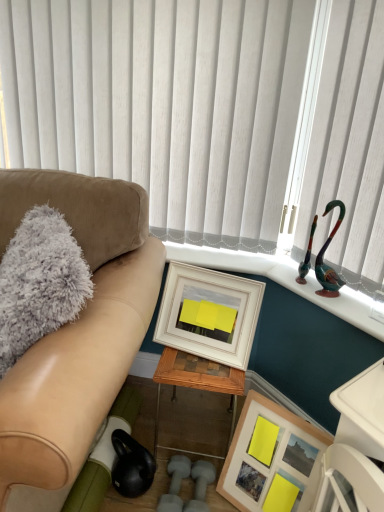
Describe the element at coordinates (164, 104) in the screenshot. The width and height of the screenshot is (384, 512). I see `white vertical blinds at upper center` at that location.

You are a GUI agent. You are given a task and a screenshot of the screen. Output one action in this format:
    pyautogui.click(x=<x>, y=<y>)
    Task: Click on the wooden framed picture at lower right, the 1th picture frame from the bottom
    
    Given the screenshot: What is the action you would take?
    pyautogui.click(x=272, y=458)

Measure the distance between suede couch at left and camera.

suede couch at left and camera are 72.38 centimeters apart.

Measure the distance between matte white picture frame at center, which appears as the second picture frame when ordered from the bottom, and camera.

matte white picture frame at center, which appears as the second picture frame when ordered from the bottom, and camera are 4.30 feet apart.

Locate an element on the screen. matte white picture frame at center, which appears as the second picture frame when ordered from the bottom is located at coordinates (209, 314).

The image size is (384, 512). I want to click on white vertical blinds at upper center, so coord(164,104).

How different are the orientations of suede couch at left and matte white picture frame at center, which appears as the second picture frame when ordered from the bottom, in degrees?

The angular difference between suede couch at left and matte white picture frame at center, which appears as the second picture frame when ordered from the bottom, is 13.2 degrees.

From a real-world perspective, who is located higher, suede couch at left or matte white picture frame at center, which appears as the second picture frame when ordered from the bottom?

matte white picture frame at center, which appears as the second picture frame when ordered from the bottom, from a real-world perspective.

From the image's perspective, which is above, suede couch at left or matte white picture frame at center, which is the first picture frame in top-to-bottom order?

matte white picture frame at center, which is the first picture frame in top-to-bottom order, from the image's perspective.

Considering the sizes of suede couch at left and matte white picture frame at center, which appears as the second picture frame when ordered from the bottom, in the image, is suede couch at left wider or thinner than matte white picture frame at center, which appears as the second picture frame when ordered from the bottom,?

Considering their sizes, suede couch at left looks broader than matte white picture frame at center, which appears as the second picture frame when ordered from the bottom.

Is point (78, 292) closer or farther from the camera than point (244, 412)?

Point (78, 292) appears to be closer to the viewer than point (244, 412).

Between gray fluffy pillow at left and wooden framed picture at lower right, the 1th picture frame from the bottom, which one has larger size?

Bigger between the two is gray fluffy pillow at left.

Where is `pillow above the wooden framed picture at lower right, the 1th picture frame from the bottom (from the image's perspective)`? pillow above the wooden framed picture at lower right, the 1th picture frame from the bottom (from the image's perspective) is located at coordinates (40, 282).

Is wooden framed picture at lower right, the 1th picture frame from the bottom, at the back of gray fluffy pillow at left?

Correct, gray fluffy pillow at left is looking away from wooden framed picture at lower right, the 1th picture frame from the bottom.

Consider the image. Does wooden framed picture at lower right, the 1th picture frame from the bottom, come in front of woodenmaterial/texturetable at center?

Yes, it is.

Is wooden framed picture at lower right, the 1th picture frame from the bottom, positioned beyond the bounds of woodenmaterial/texturetable at center?

Yes, wooden framed picture at lower right, the 1th picture frame from the bottom, is outside of woodenmaterial/texturetable at center.

Is point (270, 424) in front of point (215, 375)?

No, it is not.

Is wooden framed picture at lower right, which ranks as the 2th picture frame in top-to-bottom order, taller than woodenmaterial/texturetable at center?

No.

In the image, there is a suede couch at left. Identify the location of picture frame below it (from the image's perspective). click(272, 458).

Which is correct: suede couch at left is inside wooden framed picture at lower right, the 1th picture frame from the bottom, or outside of it?

suede couch at left is located beyond the bounds of wooden framed picture at lower right, the 1th picture frame from the bottom.

From the picture: From the image's perspective, which one is positioned higher, suede couch at left or wooden framed picture at lower right, which ranks as the 2th picture frame in top-to-bottom order?

suede couch at left.

What's the angular difference between woodenmaterial/texturetable at center and suede couch at left's facing directions?

The facing directions of woodenmaterial/texturetable at center and suede couch at left are 3.34 degrees apart.

Is woodenmaterial/texturetable at center aimed at suede couch at left?

No, woodenmaterial/texturetable at center is not oriented towards suede couch at left.

Which object is positioned more to the left, woodenmaterial/texturetable at center or suede couch at left?

Positioned to the left is suede couch at left.

Is woodenmaterial/texturetable at center looking in the opposite direction of wooden framed picture at lower right, which ranks as the 2th picture frame in top-to-bottom order?

No, woodenmaterial/texturetable at center's orientation is not away from wooden framed picture at lower right, which ranks as the 2th picture frame in top-to-bottom order.

Does point (188, 379) lie in front of point (273, 461)?

Yes, it is.

Consider the image. Is the position of woodenmaterial/texturetable at center less distant than that of wooden framed picture at lower right, the 1th picture frame from the bottom?

No, woodenmaterial/texturetable at center is behind wooden framed picture at lower right, the 1th picture frame from the bottom.

Does gray fluffy pillow at left lie behind woodenmaterial/texturetable at center?

No, gray fluffy pillow at left is closer to the camera.

Considering the relative sizes of gray fluffy pillow at left and woodenmaterial/texturetable at center in the image provided, is gray fluffy pillow at left bigger than woodenmaterial/texturetable at center?

Yes, gray fluffy pillow at left is bigger than woodenmaterial/texturetable at center.

Would you say gray fluffy pillow at left is outside woodenmaterial/texturetable at center?

Yes, gray fluffy pillow at left is outside of woodenmaterial/texturetable at center.

From the image's perspective, is gray fluffy pillow at left on top of woodenmaterial/texturetable at center?

Yes, from the image's perspective, gray fluffy pillow at left is over woodenmaterial/texturetable at center.

Starting from the suede couch at left, which picture frame is the 1st one to the right? Please provide its 2D coordinates.

[(209, 314)]

I want to click on pillow on the left side of wooden framed picture at lower right, the 1th picture frame from the bottom, so click(x=40, y=282).

Estimate the real-world distances between objects in this image. Which object is closer to suede couch at left, white vertical blinds at upper center or shiny green glass swan at upper right?

white vertical blinds at upper center.

When comparing their distances from shiny green glass swan at upper right, does gray fluffy pillow at left or wooden framed picture at lower right, which ranks as the 2th picture frame in top-to-bottom order, seem closer?

Among the two, wooden framed picture at lower right, which ranks as the 2th picture frame in top-to-bottom order, is located nearer to shiny green glass swan at upper right.

Based on their spatial positions, is matte white picture frame at center, which is the first picture frame in top-to-bottom order, or suede couch at left closer to shiny green glass swan at upper right?

The object closer to shiny green glass swan at upper right is matte white picture frame at center, which is the first picture frame in top-to-bottom order.

Based on their spatial positions, is white vertical blinds at upper center or matte white picture frame at center, which is the first picture frame in top-to-bottom order, closer to shiny green glass swan at upper right?

Among the two, matte white picture frame at center, which is the first picture frame in top-to-bottom order, is located nearer to shiny green glass swan at upper right.

Based on their spatial positions, is gray fluffy pillow at left or wooden framed picture at lower right, which ranks as the 2th picture frame in top-to-bottom order, closer to suede couch at left?

gray fluffy pillow at left is positioned closer to the anchor suede couch at left.

Considering their positions, is matte white picture frame at center, which is the first picture frame in top-to-bottom order, positioned closer to wooden framed picture at lower right, which ranks as the 2th picture frame in top-to-bottom order, than woodenmaterial/texturetable at center?

woodenmaterial/texturetable at center lies closer to wooden framed picture at lower right, which ranks as the 2th picture frame in top-to-bottom order, than the other object.

From the image, which object appears to be nearer to white vertical blinds at upper center, suede couch at left or matte white picture frame at center, which is the first picture frame in top-to-bottom order?

Among the two, matte white picture frame at center, which is the first picture frame in top-to-bottom order, is located nearer to white vertical blinds at upper center.

From the picture: Based on their spatial positions, is wooden framed picture at lower right, the 1th picture frame from the bottom, or woodenmaterial/texturetable at center further from suede couch at left?

wooden framed picture at lower right, the 1th picture frame from the bottom.

Where is `pillow located between suede couch at left and wooden framed picture at lower right, which ranks as the 2th picture frame in top-to-bottom order, in the left-right direction`? The width and height of the screenshot is (384, 512). pillow located between suede couch at left and wooden framed picture at lower right, which ranks as the 2th picture frame in top-to-bottom order, in the left-right direction is located at coordinates (40, 282).

In order to click on pillow located between suede couch at left and woodenmaterial/texturetable at center in the depth direction in this screenshot , I will do `click(40, 282)`.

The width and height of the screenshot is (384, 512). I want to click on toy between white vertical blinds at upper center and wooden framed picture at lower right, the 1th picture frame from the bottom, in the up-down direction, so click(323, 256).

Image resolution: width=384 pixels, height=512 pixels. I want to click on table located between gray fluffy pillow at left and matte white picture frame at center, which appears as the second picture frame when ordered from the bottom, in the left-right direction, so click(197, 381).